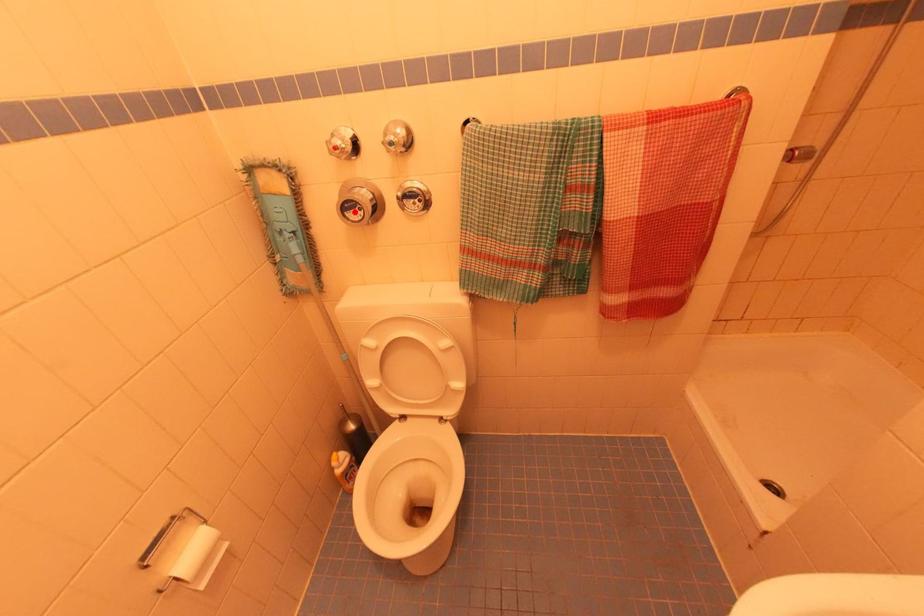
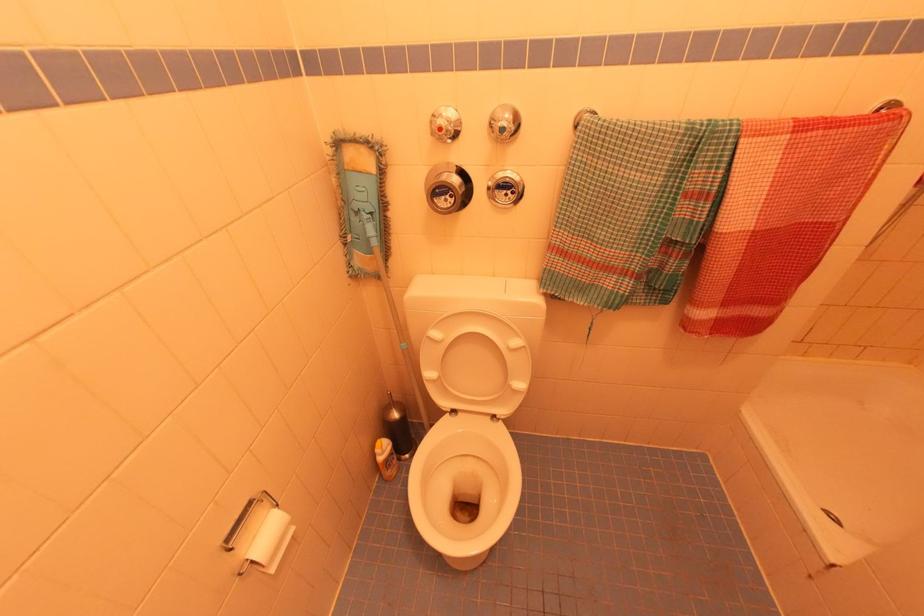
Question: I am providing you with two images of the same scene from different viewpoints. A red point is marked on the first image. Can you still see the location of the red point in image 2?

Choices:
 (A) Yes
 (B) No

Answer: (A)